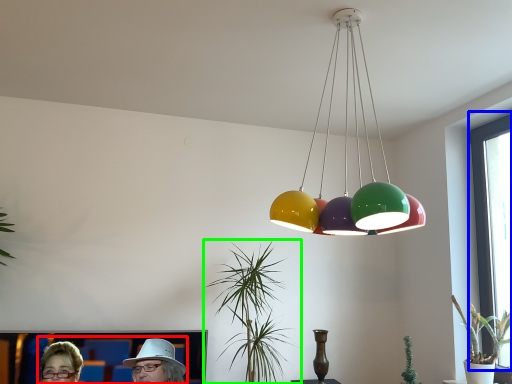
Question: Considering the real-world distances, which object is closest to couple (highlighted by a red box)? window screen (highlighted by a blue box) or houseplant (highlighted by a green box).

Choices:
 (A) window screen
 (B) houseplant

Answer: (B)